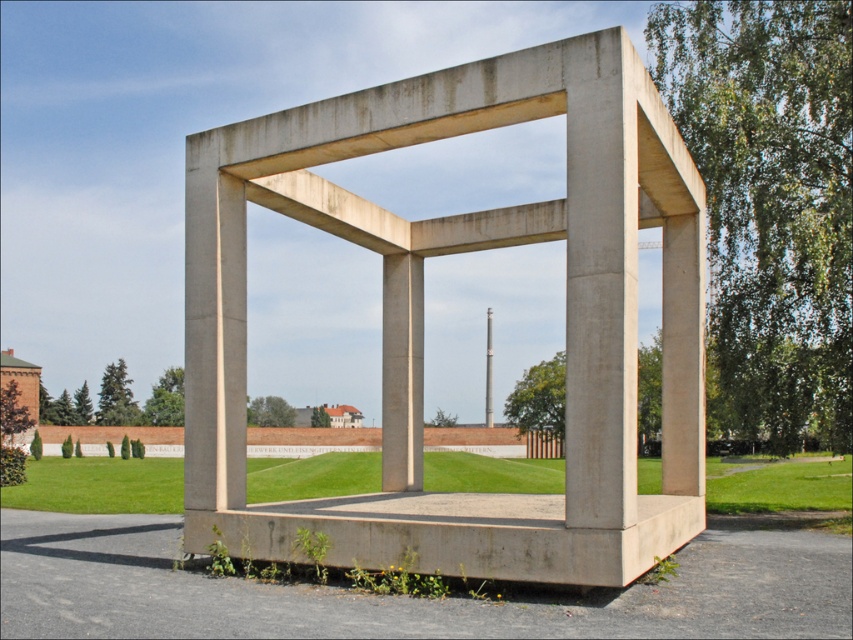
You are standing at the center of the paved area in front of the memorial structure. If you face the smooth concrete frame at center, which direction should you turn to look towards the brick wall and trees in the background?

Since the smooth concrete frame at center is positioned at point (402,596), which is near the center of the image, and the brick wall with trees is in the background beyond the structure, you should turn to face the direction opposite the smooth concrete frame at center to see the brick wall and trees. However, without specific coordinate directions, the exact turn direction cannot be determined. The question might require more context about the image orientation.